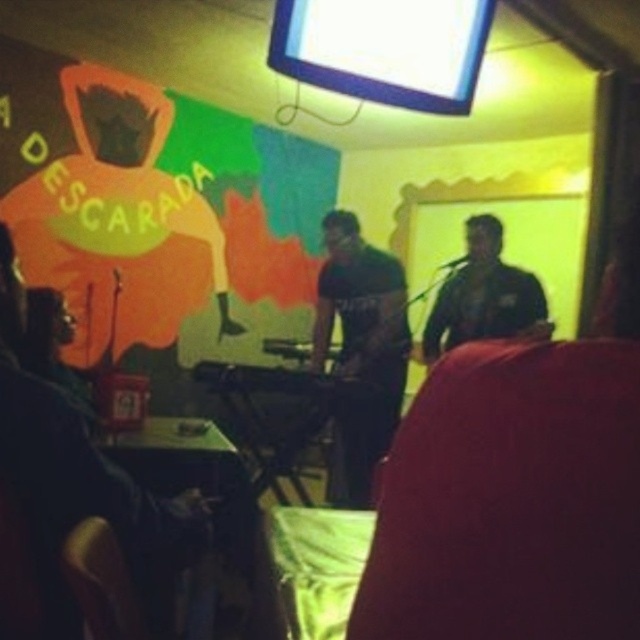
You are a stagehand setting up equipment for a performance. You have a black matte keyboard at center and a black matte guitar at center. Which one should you adjust to ensure it doesn not block the view of the audience? Explain your reasoning.

The black matte keyboard at center is much taller than the black matte guitar at center. Therefore, you should adjust the black matte keyboard at center to ensure it does not block the audience view.

You are a stagehand setting up equipment for the performance. You have a black matte keyboard at center and a black matte guitar at center. Which one requires more space to place properly?

The black matte keyboard at center is larger in size than the black matte guitar at center, so it requires more space to place properly.

Consider the image. You are standing in the venue and want to place a small plant on the table where the black matte keyboard at center is. The table has a rectangular surface. Can you determine if there is enough space for the plant next to the keyboard?

The black matte keyboard at center is located at point (360, 349). Since the table is rectangular, there is likely enough space next to the keyboard for the plant unless the table is very small. However, without knowing the table size or the plant size, it is hard to say for sure.